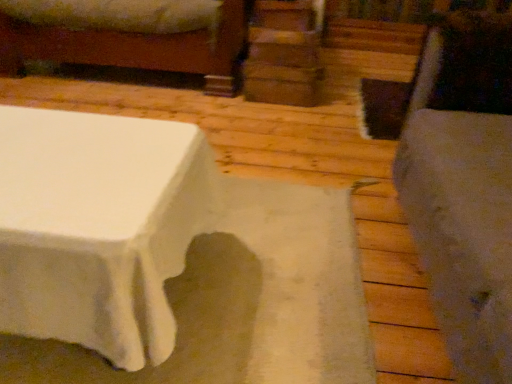
I want to click on free location to the left of fuzzy gray swivel chair at right, so click(x=273, y=272).